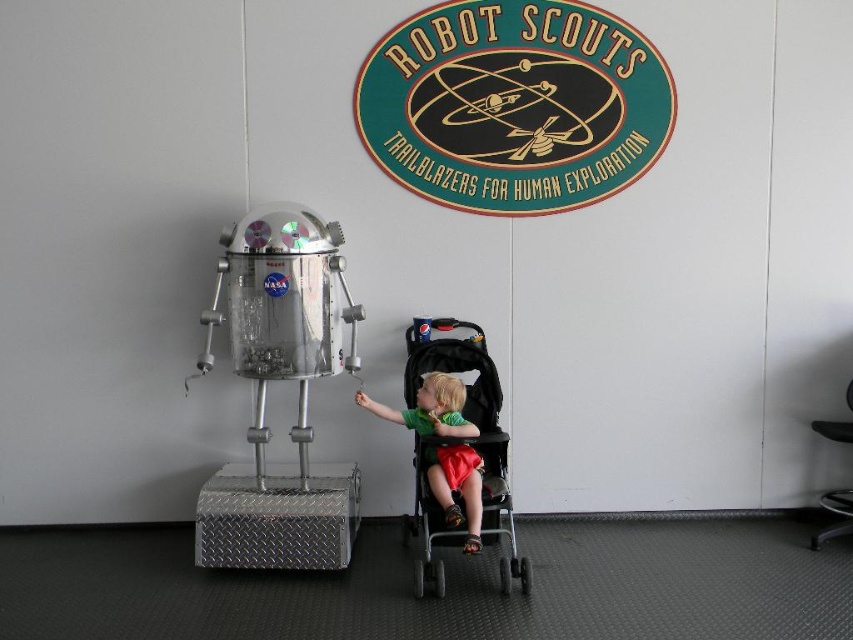
You are a security guard in the room and need to locate the black fabric stroller at lower center. According to the coordinates provided, where should you look to find it?

The black fabric stroller at lower center is located at coordinates point (477, 428).

You are a parent trying to ensure your child is safe while they interact with the metallic robot sculpture. Given the positions of the black fabric stroller at lower center and the green fabric shirt at lower center, which object is closer to the robot sculpture?

The black fabric stroller at lower center is positioned on the right side of the green fabric shirt at lower center. Since the robot sculpture is to the right of the child in the stroller, the green fabric shirt at lower center is closer to the robot sculpture.